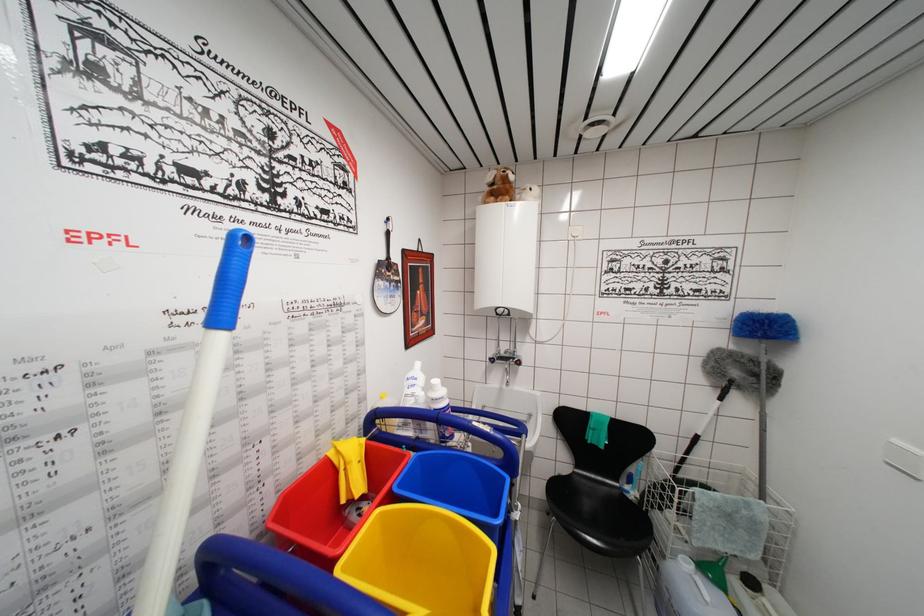
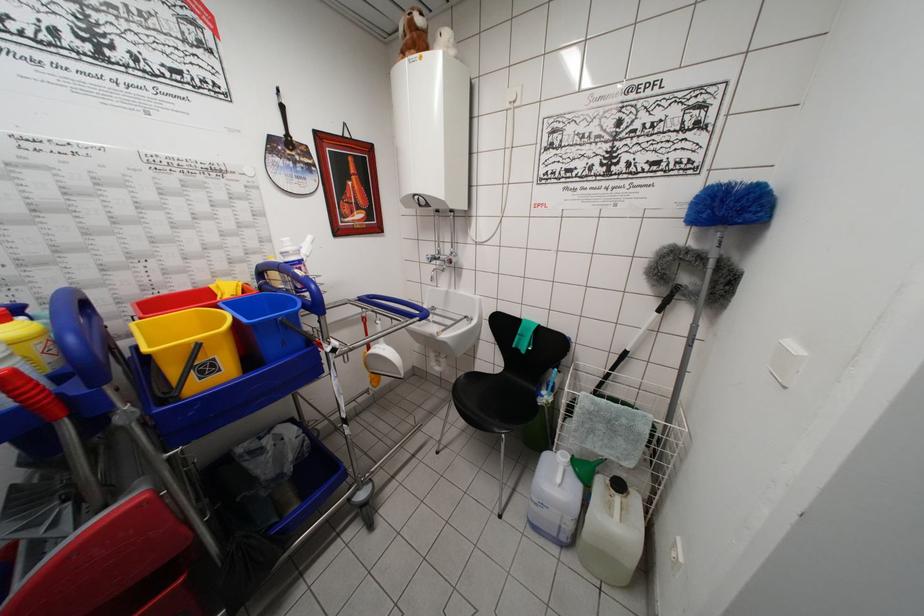
Locate, in the second image, the point that corresponds to point 690,458 in the first image.

(616, 374)